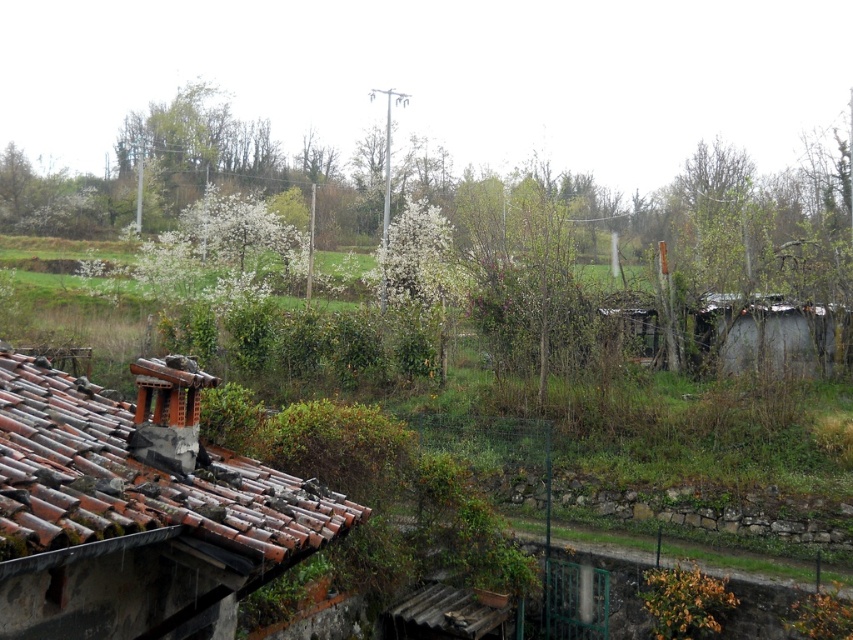
You are standing on the balcony and looking at the scene. Where exactly are the rusty clay roof tiles at lower left located in the image?

The rusty clay roof tiles at lower left are located at point (136, 509) in the image.

You are a photographer planning to capture a wide shot of the rural scene. Given that the rusty clay roof tiles at lower left and the rusty corrugated metal hut at right are both in your frame, which object would you need to adjust your camera angle to include more of, considering their widths?

The rusty clay roof tiles at lower left are wider than the rusty corrugated metal hut at right, so you would need to adjust your camera angle to include more of the rusty clay roof tiles at lower left.

You are standing on a balcony overlooking the scene. You see the rusty clay roof tiles at lower left and the rusty corrugated metal hut at right. Which object is positioned lower in the image?

The rusty clay roof tiles at lower left are positioned lower in the image than the rusty corrugated metal hut at right.